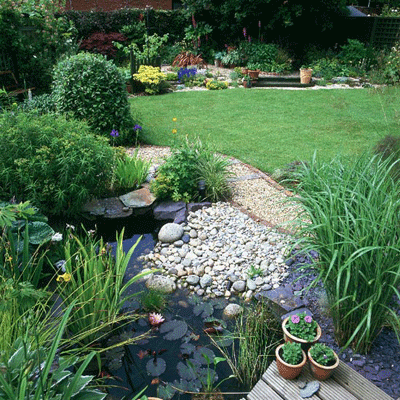
I want to click on wall, so click(x=104, y=5).